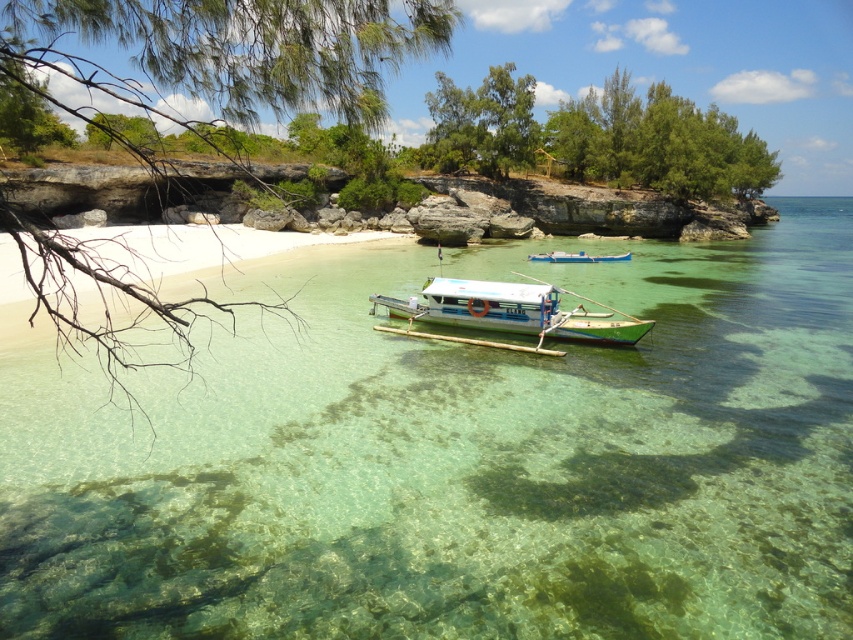
Does clear glassy water at center have a larger size compared to white matte boat at center?

Correct, clear glassy water at center is larger in size than white matte boat at center.

Image resolution: width=853 pixels, height=640 pixels. Describe the element at coordinates (461, 465) in the screenshot. I see `clear glassy water at center` at that location.

At what (x,y) coordinates should I click in order to perform the action: click on clear glassy water at center. Please return your answer as a coordinate pair (x, y). Looking at the image, I should click on click(x=461, y=465).

Does clear glassy water at center have a lesser width compared to white plastic boat at center?

No.

Between clear glassy water at center and white plastic boat at center, which one is positioned lower?

clear glassy water at center is below.

Locate an element on the screen. This screenshot has height=640, width=853. clear glassy water at center is located at coordinates (461, 465).

Between white matte boat at center and white plastic boat at center, which one has more height?

white matte boat at center

Identify the location of white matte boat at center. tap(512, 310).